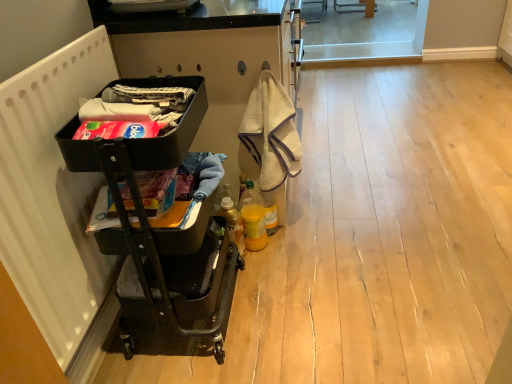
Question: In terms of width, does matte black laundry basket at left, which is the second laundry in top-to-bottom order, look wider or thinner when compared to matte black laundry basket at left, which appears as the 1th laundry when viewed from the top?

Choices:
 (A) thin
 (B) wide

Answer: (B)

Question: Does point (173, 190) appear closer or farther from the camera than point (158, 110)?

Choices:
 (A) farther
 (B) closer

Answer: (A)

Question: Estimate the real-world distances between objects in this image. Which object is farther from the beige towel at center?

Choices:
 (A) matte black laundry basket at left, which is the second laundry in top-to-bottom order
 (B) translucent plastic bottle at lower center, placed as the second bottle when sorted from right to left
 (C) black metal cart at left
 (D) matte black laundry basket at left, marked as the 2th laundry in a bottom-to-top arrangement
 (E) white matte radiator at left

Answer: (E)

Question: Estimate the real-world distances between objects in this image. Which object is farther from the translucent plastic bottle at lower center, placed as the second bottle when sorted from right to left?

Choices:
 (A) white matte radiator at left
 (B) black metal cart at left
 (C) translucent plastic bottle at center, the 2th bottle viewed from the left
 (D) matte black laundry basket at left, which is the second laundry in top-to-bottom order
 (E) beige towel at center

Answer: (A)